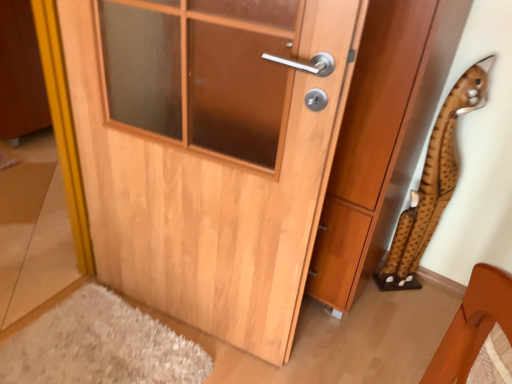
What is the approximate height of wooden door at center?

wooden door at center is 4.00 feet tall.

Find the location of `wooden door at center`. wooden door at center is located at coordinates (381, 138).

From the picture: How different are the orientations of brown spotted plush at right and wooden door at center in degrees?

brown spotted plush at right and wooden door at center are facing 36.8 degrees away from each other.

Is wooden door at center a part of brown spotted plush at right?

No, wooden door at center is not inside brown spotted plush at right.

Can you confirm if brown spotted plush at right is thinner than wooden door at center?

Yes.

Is there a large distance between brown spotted plush at right and wooden door at center?

No, brown spotted plush at right is not far from wooden door at center.

Considering the sizes of objects wooden door at center and light wood door at center in the image provided, who is wider, wooden door at center or light wood door at center?

wooden door at center.

Which of these two, wooden door at center or light wood door at center, stands taller?

wooden door at center.

From a real-world perspective, between wooden door at center and light wood door at center, who is vertically lower?

From a 3D spatial view, wooden door at center is below.

What's the angular difference between wooden door at center and light wood door at center's facing directions?

wooden door at center and light wood door at center are facing 7.89 degrees away from each other.

Do you think light wood door at center is within wooden door at center, or outside of it?

light wood door at center exists outside the volume of wooden door at center.

Considering the relative sizes of light wood door at center and wooden door at center in the image provided, is light wood door at center wider than wooden door at center?

In fact, light wood door at center might be narrower than wooden door at center.

Which of these two, light wood door at center or wooden door at center, is bigger?

With larger size is wooden door at center.

Where is `animal below the wooden door at center (from the image's perspective)`? The width and height of the screenshot is (512, 384). animal below the wooden door at center (from the image's perspective) is located at coordinates (433, 182).

Do you think wooden door at center is within brown spotted plush at right, or outside of it?

wooden door at center exists outside the volume of brown spotted plush at right.

Is wooden door at center not near brown spotted plush at right?

wooden door at center is near brown spotted plush at right, not far away.

Is wooden door at center turned away from brown spotted plush at right?

wooden door at center is not turned away from brown spotted plush at right.

Considering the sizes of objects light wood door at center and brown spotted plush at right in the image provided, who is bigger, light wood door at center or brown spotted plush at right?

With larger size is light wood door at center.

Could you tell me if light wood door at center is facing brown spotted plush at right?

No, light wood door at center does not turn towards brown spotted plush at right.

Is light wood door at center in contact with brown spotted plush at right?

light wood door at center is not next to brown spotted plush at right, and they're not touching.

Considering the sizes of objects brown spotted plush at right and light wood door at center in the image provided, who is wider, brown spotted plush at right or light wood door at center?

With larger width is light wood door at center.

Can you see brown spotted plush at right touching light wood door at center?

brown spotted plush at right and light wood door at center are not in contact.

Can you confirm if brown spotted plush at right is positioned to the right of light wood door at center?

Yes, brown spotted plush at right is to the right of light wood door at center.

Could you tell me if brown spotted plush at right is turned towards light wood door at center?

No, brown spotted plush at right is not facing towards light wood door at center.

What are the coordinates of `cabinetry on the left of brown spotted plush at right` in the screenshot? It's located at (381, 138).

You are a GUI agent. You are given a task and a screenshot of the screen. Output one action in this format:
    pyautogui.click(x=<x>, y=<y>)
    Task: Click on the door that is below the wooden door at center (from the image's perspective)
    
    Given the screenshot: What is the action you would take?
    pyautogui.click(x=210, y=151)

Estimate the real-world distances between objects in this image. Which object is further from light wood door at center, wooden door at center or brown spotted plush at right?

→ The object further to light wood door at center is brown spotted plush at right.

From the image, which object appears to be farther from brown spotted plush at right, wooden door at center or light wood door at center?

light wood door at center is further to brown spotted plush at right.

From the image, which object appears to be farther from brown spotted plush at right, light wood door at center or wooden door at center?

The object further to brown spotted plush at right is light wood door at center.

Estimate the real-world distances between objects in this image. Which object is further from wooden door at center, light wood door at center or brown spotted plush at right?

Among the two, light wood door at center is located further to wooden door at center.

Considering their positions, is brown spotted plush at right positioned further to wooden door at center than light wood door at center?

light wood door at center is further to wooden door at center.

When comparing their distances from light wood door at center, does brown spotted plush at right or wooden door at center seem closer?

wooden door at center.

The height and width of the screenshot is (384, 512). Identify the location of cabinetry between light wood door at center and brown spotted plush at right. (381, 138).